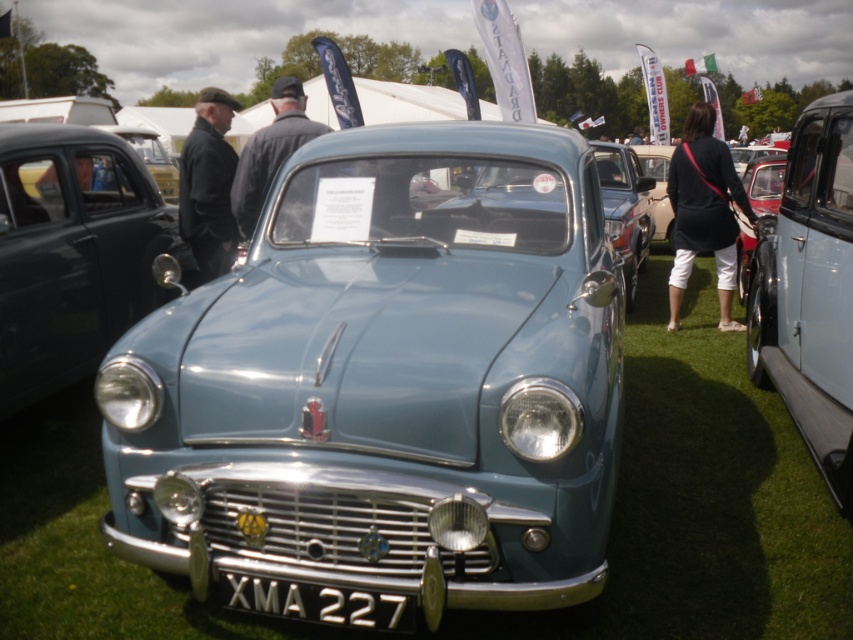
Measure the distance between dark blue fabric dress at center and camera.

dark blue fabric dress at center and camera are 20.96 feet apart.

Is dark blue fabric dress at center above black metal/texture license plate at center?

Correct, dark blue fabric dress at center is located above black metal/texture license plate at center.

Who is more forward, (724, 266) or (358, 595)?

Point (358, 595) is more forward.

At what (x,y) coordinates should I click in order to perform the action: click on dark blue fabric dress at center. Please return your answer as a coordinate pair (x, y). The width and height of the screenshot is (853, 640). Looking at the image, I should click on (703, 211).

Does matte blue car at center appear on the left side of light blue metallic car at right?

Indeed, matte blue car at center is positioned on the left side of light blue metallic car at right.

Which is more to the right, matte blue car at center or light blue metallic car at right?

From the viewer's perspective, light blue metallic car at right appears more on the right side.

Identify the location of matte blue car at center. The height and width of the screenshot is (640, 853). (73, 253).

This screenshot has width=853, height=640. I want to click on matte blue car at center, so click(73, 253).

Does matte blue car at center have a greater width compared to light blue metallic car at center?

No, matte blue car at center is not wider than light blue metallic car at center.

Is matte blue car at center below light blue metallic car at center?

Yes, matte blue car at center is below light blue metallic car at center.

Does point (22, 160) lie behind point (627, 200)?

No, it is in front of (627, 200).

The image size is (853, 640). Find the location of `matte blue car at center`. matte blue car at center is located at coordinates click(x=73, y=253).